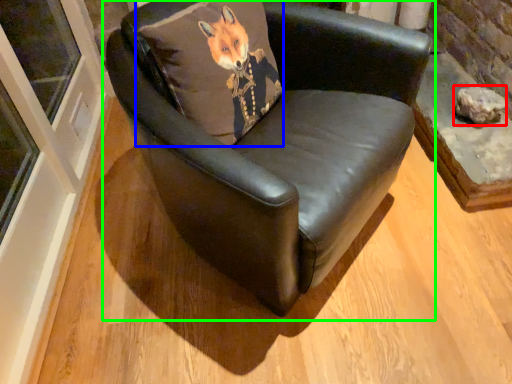
Question: Which object is positioned closest to stone (highlighted by a red box)? Select from pillow (highlighted by a blue box) and chair (highlighted by a green box).

Choices:
 (A) pillow
 (B) chair

Answer: (B)